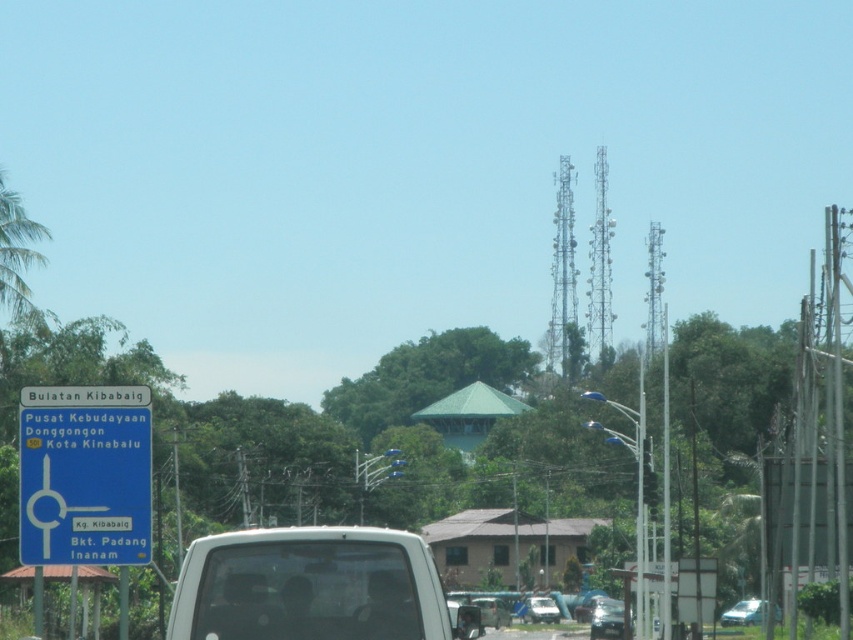
Question: Among these points, which one is nearest to the camera?

Choices:
 (A) [x=607, y=614]
 (B) [x=32, y=396]

Answer: (B)

Question: Is white matte van at center smaller than metallic silver car at lower center?

Choices:
 (A) yes
 (B) no

Answer: (A)

Question: Among these objects, which one is nearest to the camera?

Choices:
 (A) matte black car at lower center
 (B) metallic silver car at lower right

Answer: (A)

Question: Which of the following is the closest to the observer?

Choices:
 (A) light blue metallic car at lower right
 (B) metallic silver car at lower right
 (C) metallic silver car at lower center
 (D) blue plastic sign at upper left

Answer: (D)

Question: Does white matte van at center appear on the left side of light blue metallic car at lower right?

Choices:
 (A) no
 (B) yes

Answer: (B)

Question: Does blue plastic sign at upper left appear on the left side of metallic silver car at lower right?

Choices:
 (A) yes
 (B) no

Answer: (A)